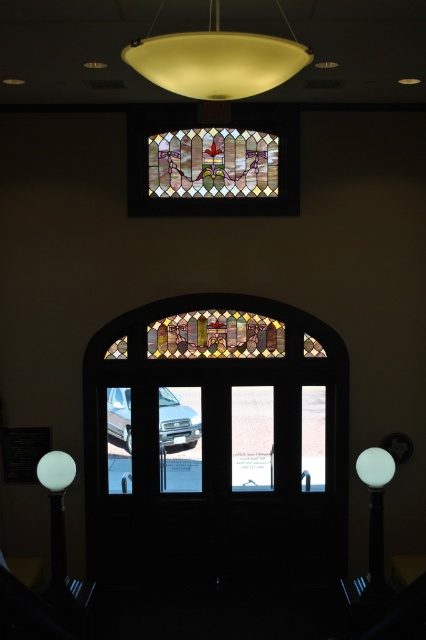
You are standing in a room and want to exit through the arched doorway. You notice two stained glass windows. One is labeled as the stained glass window at center and the other as the stained glass window at upper center. Which of these two windows is closer to you as you face the doorway?

The stained glass window at center is closer to you because it is in front of the stained glass window at upper center.

You are standing in the interior space and want to move from point (x=92, y=502) to point (x=385, y=593). Can you walk directly between them without any obstacles?

Point (x=92, y=502) is behind point (x=385, y=593), so you cannot walk directly between them without going around point (x=385, y=593).